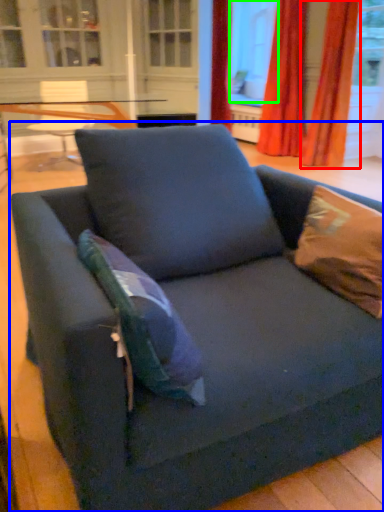
Question: Which is nearer to the curtain (highlighted by a red box)? studio couch (highlighted by a blue box) or window screen (highlighted by a green box).

Choices:
 (A) studio couch
 (B) window screen

Answer: (B)